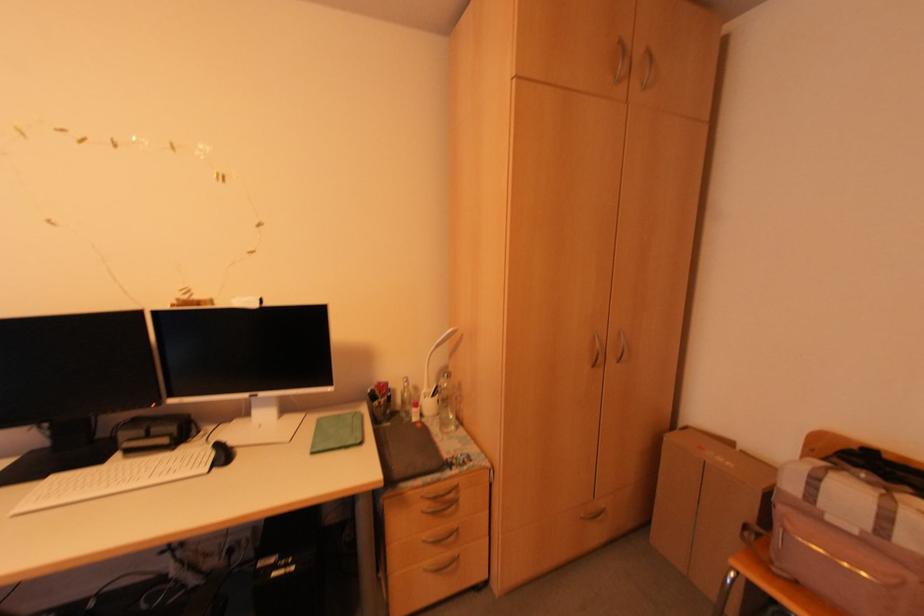
Where would you lift the black computer mouse? Please return your answer as a coordinate pair (x, y).

(222, 454)